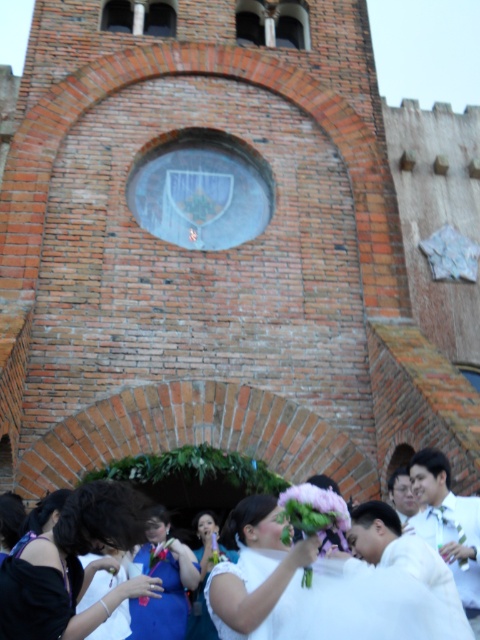
Can you confirm if pink floral bouquet at center is positioned to the left of white satin dress at lower left?

In fact, pink floral bouquet at center is to the right of white satin dress at lower left.

Is pink floral bouquet at center shorter than white satin dress at lower left?

No, pink floral bouquet at center is not shorter than white satin dress at lower left.

Which is behind, point (291, 493) or point (96, 634)?

Positioned behind is point (291, 493).

Where is `pink floral bouquet at center`? This screenshot has height=640, width=480. pink floral bouquet at center is located at coordinates (313, 508).

From the picture: Which is below, white satin dress at center or blue satin dress at lower left?

blue satin dress at lower left is lower down.

Who is more forward, (336, 616) or (177, 628)?

Point (336, 616) is more forward.

Find the location of a particular element. The image size is (480, 640). white satin dress at center is located at coordinates click(x=360, y=608).

Which of these two, white satin dress at lower center or white glossy shirt at lower right, stands taller?

Standing taller between the two is white glossy shirt at lower right.

Does white satin dress at lower center have a greater height compared to white glossy shirt at lower right?

Incorrect, white satin dress at lower center's height is not larger of white glossy shirt at lower right's.

The image size is (480, 640). I want to click on white satin dress at lower center, so click(x=72, y=566).